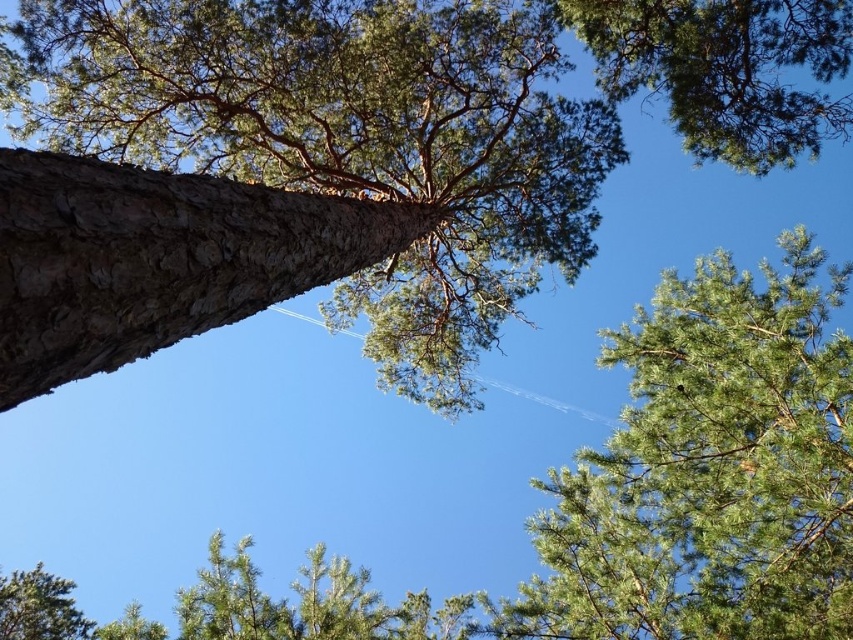
Based on the photo, is the position of green needle-like at upper center less distant than that of green needle-like at upper right?

Yes.

You are a GUI agent. You are given a task and a screenshot of the screen. Output one action in this format:
    pyautogui.click(x=<x>, y=<y>)
    Task: Click on the green needle-like at upper center
    Image resolution: width=853 pixels, height=640 pixels.
    Given the screenshot: What is the action you would take?
    pyautogui.click(x=709, y=472)

Looking at this image, can you confirm if green rough bark tree at center is positioned to the left of green needle-like at upper center?

Yes, green rough bark tree at center is to the left of green needle-like at upper center.

How far apart are green rough bark tree at center and green needle-like at upper center?

green rough bark tree at center is 21.21 feet away from green needle-like at upper center.

Who is more forward, (171, 308) or (820, 250)?

Positioned in front is point (171, 308).

Locate an element on the screen. This screenshot has width=853, height=640. green rough bark tree at center is located at coordinates (352, 154).

Is green rough bark tree at center to the left of green needle-like at upper right from the viewer's perspective?

Correct, you'll find green rough bark tree at center to the left of green needle-like at upper right.

Is green rough bark tree at center shorter than green needle-like at upper right?

No, green rough bark tree at center is not shorter than green needle-like at upper right.

Which is behind, point (71, 24) or point (700, 109)?

Positioned behind is point (700, 109).

Find the location of a particular element. Image resolution: width=853 pixels, height=640 pixels. green rough bark tree at center is located at coordinates (352, 154).